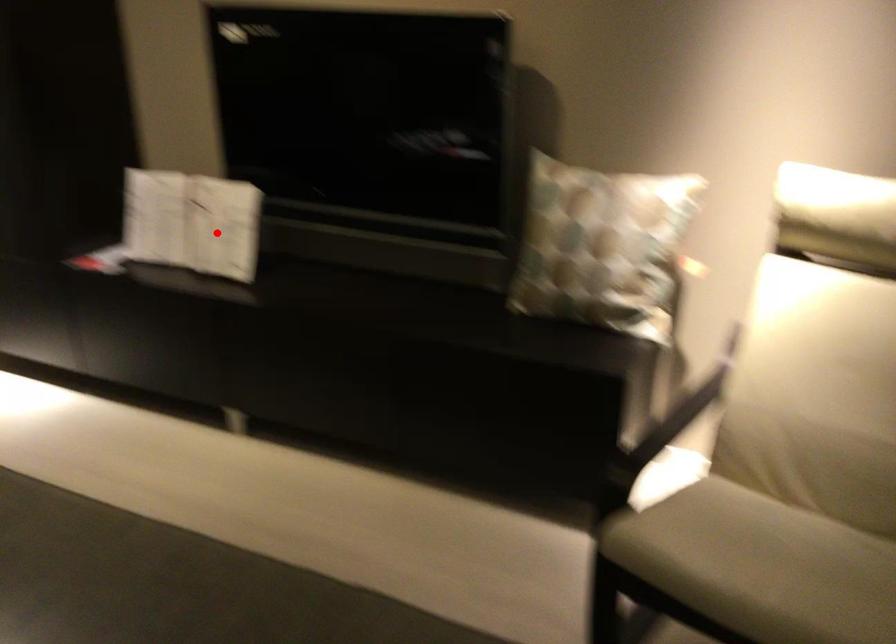
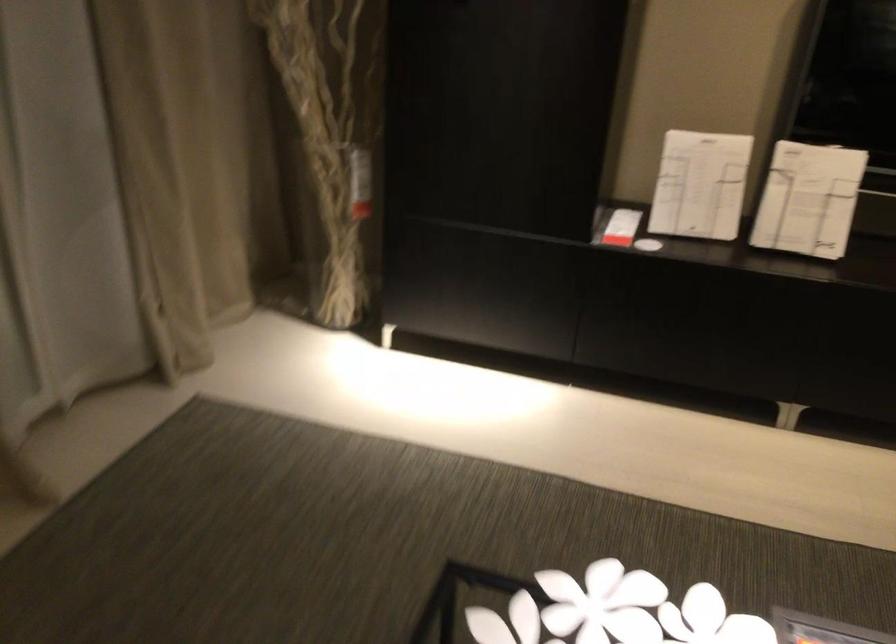
Question: A red point is marked in image1. In image2, is the corresponding 3D point closer to the camera or farther? Reply with the corresponding letter.

Choices:
 (A) The corresponding 3D point is closer.
 (B) The corresponding 3D point is farther.

Answer: (A)